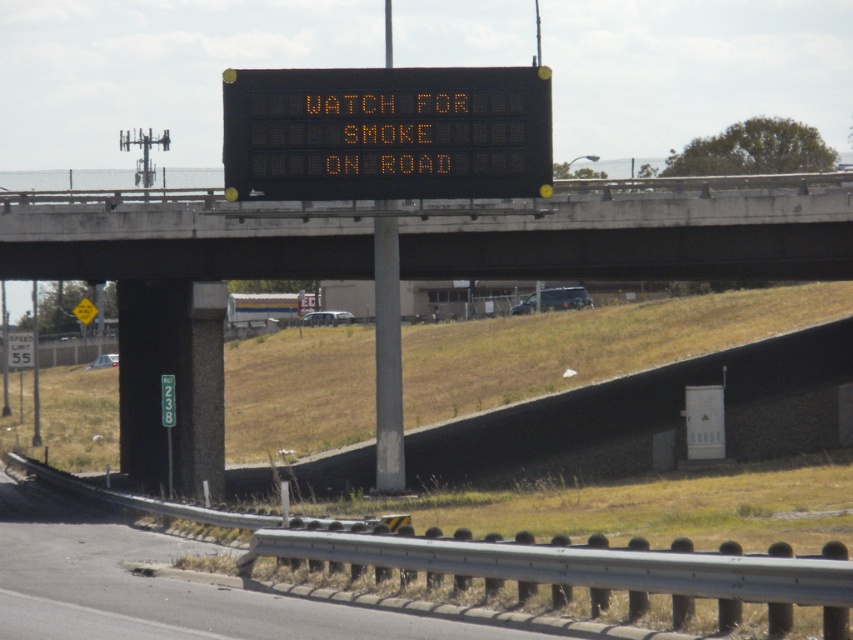
Does concrete at upper center have a greater width compared to black concrete overpass at upper center?

Correct, the width of concrete at upper center exceeds that of black concrete overpass at upper center.

Identify the location of concrete at upper center. The image size is (853, 640). (398, 264).

Does concrete at upper center appear over black electronic display at upper center?

No, concrete at upper center is not above black electronic display at upper center.

What do you see at coordinates (398, 264) in the screenshot? The width and height of the screenshot is (853, 640). I see `concrete at upper center` at bounding box center [398, 264].

Between point (270, 243) and point (260, 106), which one is positioned behind?

The point (270, 243) is more distant.

I want to click on concrete at upper center, so click(398, 264).

What do you see at coordinates (640, 230) in the screenshot? The width and height of the screenshot is (853, 640). I see `black concrete overpass at upper center` at bounding box center [640, 230].

Is black concrete overpass at upper center below black electronic display at upper center?

Yes, black concrete overpass at upper center is below black electronic display at upper center.

Is point (167, 240) positioned after point (399, 72)?

Yes, it is behind point (399, 72).

Identify the location of black concrete overpass at upper center. The width and height of the screenshot is (853, 640). (640, 230).